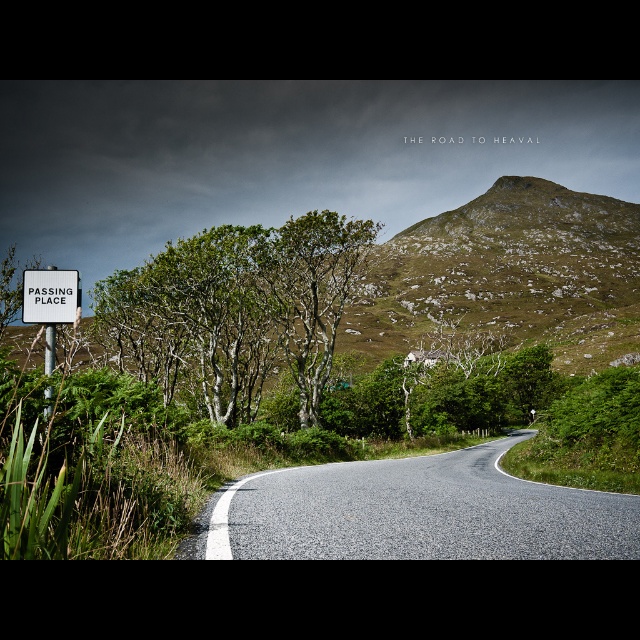
Question: Which point is farther to the camera?

Choices:
 (A) (56, 294)
 (B) (305, 262)
 (C) (289, 355)

Answer: (C)

Question: Does green leafy tree at left appear under white plastic sign at left?

Choices:
 (A) yes
 (B) no

Answer: (B)

Question: Which object appears farthest from the camera in this image?

Choices:
 (A) white plastic sign at left
 (B) asphalt road at center

Answer: (B)

Question: Estimate the real-world distances between objects in this image. Which object is closer to the green leafy tree at left?

Choices:
 (A) asphalt road at center
 (B) green textured tree at center
 (C) white plastic sign at left

Answer: (B)

Question: Is asphalt road at center wider than green textured tree at center?

Choices:
 (A) yes
 (B) no

Answer: (B)

Question: Can you confirm if green leafy tree at left is wider than green textured tree at center?

Choices:
 (A) no
 (B) yes

Answer: (B)